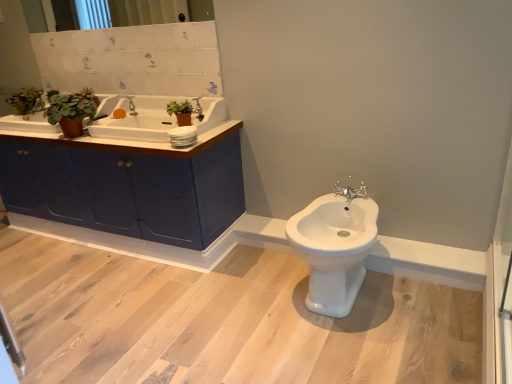
Find the location of `free spot to the left of white glossy bidet at center`. free spot to the left of white glossy bidet at center is located at coordinates 250,306.